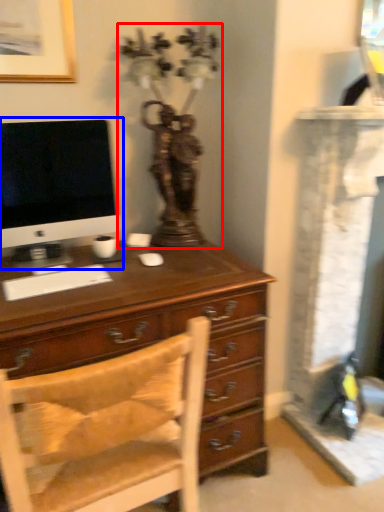
Question: Which object appears closest to the camera in this image, antique (highlighted by a red box) or computer monitor (highlighted by a blue box)?

Choices:
 (A) antique
 (B) computer monitor

Answer: (B)